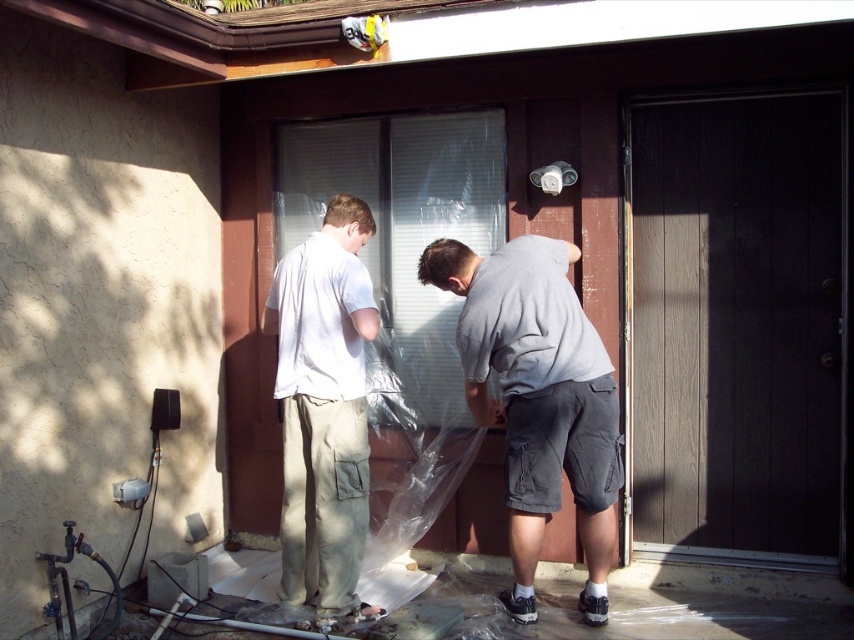
Is transparent plastic at center bigger than light beige cargo pants at center?

Indeed, transparent plastic at center has a larger size compared to light beige cargo pants at center.

Which is more to the left, transparent plastic at center or light beige cargo pants at center?

Positioned to the left is light beige cargo pants at center.

Is point (484, 115) positioned after point (319, 397)?

Yes, it is behind point (319, 397).

Find the location of `transparent plastic at center`. transparent plastic at center is located at coordinates (402, 236).

Does gray cotton shirt at center come in front of light beige cargo pants at center?

Yes, gray cotton shirt at center is closer to the viewer.

Is point (530, 467) positioned after point (314, 516)?

No, (530, 467) is in front of (314, 516).

Describe the element at coordinates (537, 400) in the screenshot. I see `gray cotton shirt at center` at that location.

Where is `gray cotton shirt at center`? The width and height of the screenshot is (854, 640). gray cotton shirt at center is located at coordinates (537, 400).

Is the position of dark wood screen door at right more distant than that of gray cotton shirt at center?

Yes.

Can you confirm if dark wood screen door at right is shorter than gray cotton shirt at center?

No, dark wood screen door at right is not shorter than gray cotton shirt at center.

Does point (779, 339) lie in front of point (461, 364)?

No, (779, 339) is further to viewer.

You are a GUI agent. You are given a task and a screenshot of the screen. Output one action in this format:
    pyautogui.click(x=<x>, y=<y>)
    Task: Click on the dark wood screen door at right
    This screenshot has height=640, width=854.
    Given the screenshot: What is the action you would take?
    coord(738,323)